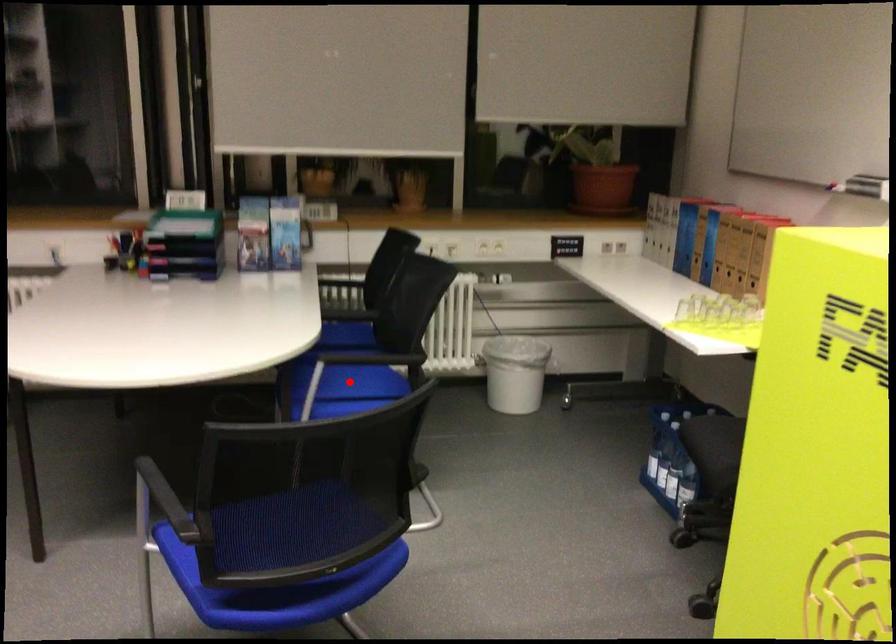
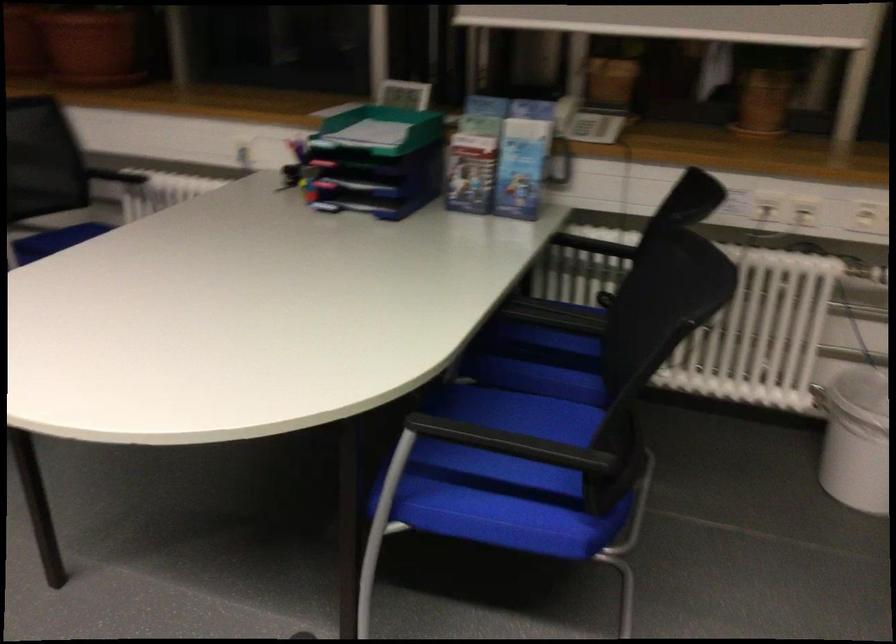
Question: I am providing you with two images of the same scene from different viewpoints. A red point is marked on the first image. Is the red point's position out of view in image 2?

Choices:
 (A) Yes
 (B) No

Answer: (A)